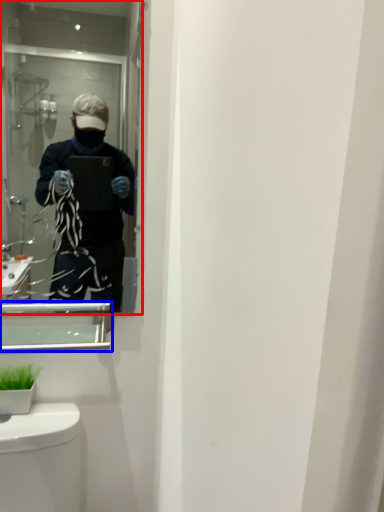
Question: Which object is further to the camera taking this photo, mirror (highlighted by a red box) or medicine cabinet (highlighted by a blue box)?

Choices:
 (A) mirror
 (B) medicine cabinet

Answer: (B)